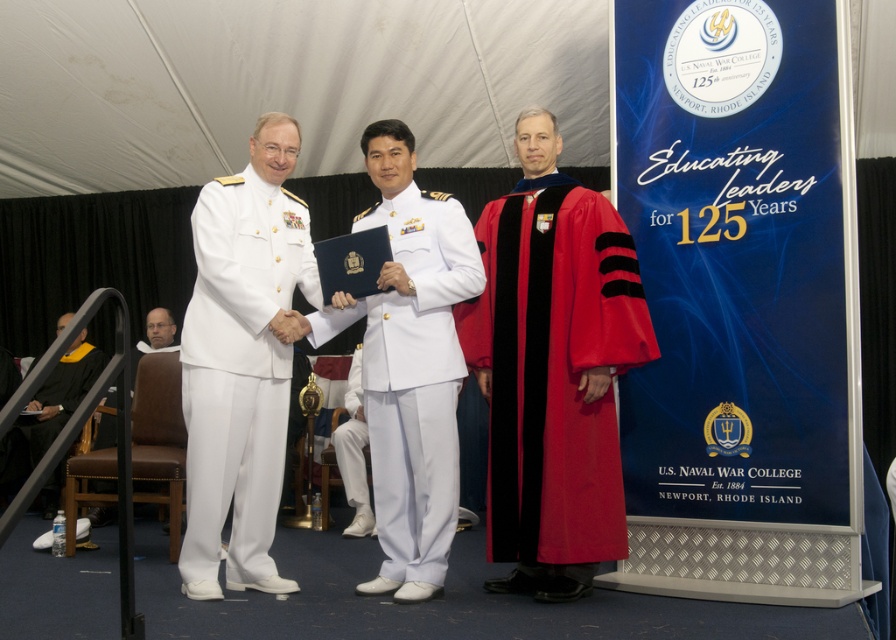
Question: Which point appears farthest from the camera in this image?

Choices:
 (A) click(440, 474)
 (B) click(359, 376)

Answer: (B)

Question: Which of these objects is positioned closest to the black matte graduation gown at lower left?

Choices:
 (A) white matte uniform at center
 (B) white matte pants at center

Answer: (B)

Question: Can you confirm if white matte uniform at center is positioned above black matte graduation gown at lower left?

Choices:
 (A) no
 (B) yes

Answer: (B)

Question: From the image, what is the correct spatial relationship of shiny red graduation gown at right in relation to white matte uniform at left?

Choices:
 (A) above
 (B) below

Answer: (A)

Question: Which of the following is the farthest from the observer?

Choices:
 (A) white matte pants at center
 (B) white matte uniform at center
 (C) white matte uniform at left
 (D) shiny red graduation gown at right

Answer: (A)

Question: Can you confirm if white matte uniform at left is positioned above white matte uniform at center?

Choices:
 (A) yes
 (B) no

Answer: (A)